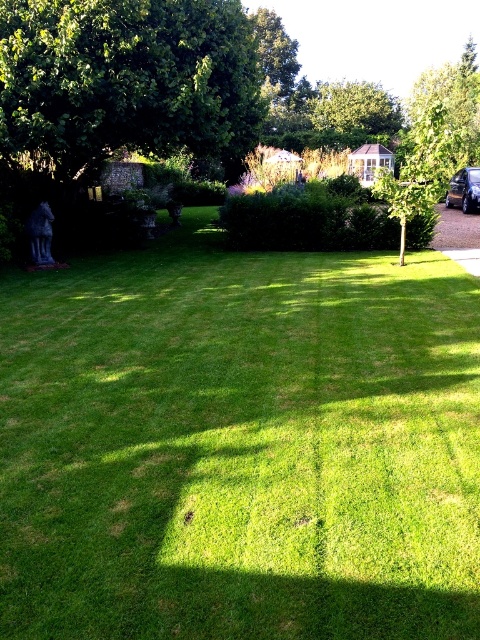
Is green leafy tree at upper left above shiny black car at right?

Yes, green leafy tree at upper left is above shiny black car at right.

Who is more distant from viewer, (103, 72) or (472, 179)?

Positioned behind is point (472, 179).

Measure the distance between point (15, 148) and camera.

Point (15, 148) is 10.40 meters from camera.

Locate an element on the screen. This screenshot has width=480, height=640. green leafy tree at upper left is located at coordinates (126, 81).

Is point (158, 467) closer to camera compared to point (429, 80)?

Yes, point (158, 467) is in front of point (429, 80).

Does green grass at center have a lesser height compared to green leafy tree at center?

Yes.

The image size is (480, 640). What are the coordinates of `green grass at center` in the screenshot? It's located at (240, 445).

Which is more to the left, green leafy tree at upper left or green leafy tree at center?

green leafy tree at upper left is more to the left.

Based on the photo, who is lower down, green leafy tree at upper left or green leafy tree at center?

green leafy tree at upper left is below.

What do you see at coordinates (126, 81) in the screenshot?
I see `green leafy tree at upper left` at bounding box center [126, 81].

The height and width of the screenshot is (640, 480). Identify the location of green leafy tree at upper left. (126, 81).